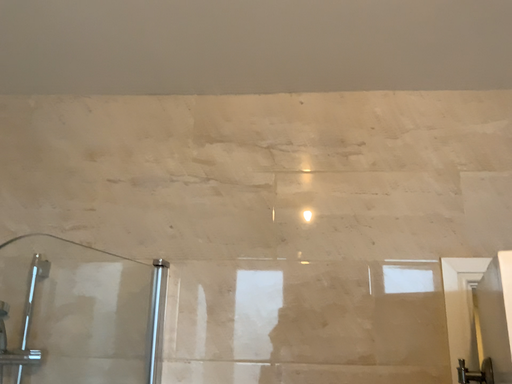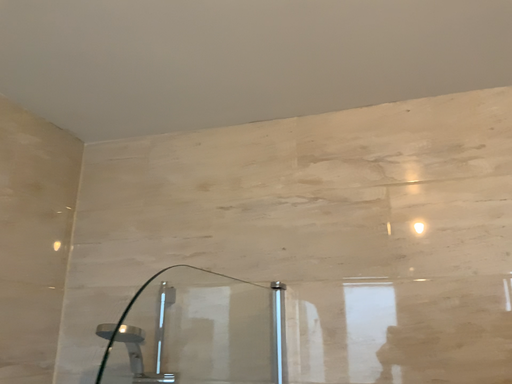
Question: Which way did the camera rotate in the video?

Choices:
 (A) rotated left
 (B) rotated right

Answer: (A)